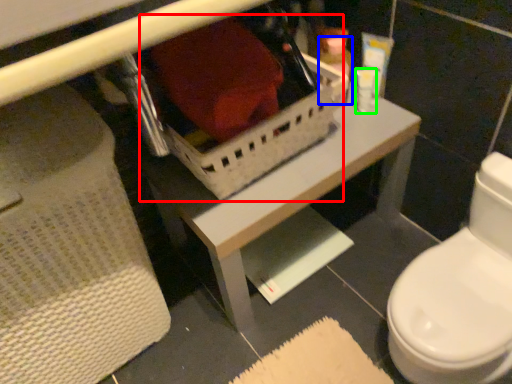
Question: Which object is positioned closest to storage box (highlighted by a red box)? Select from toiletry (highlighted by a blue box) and toiletry (highlighted by a green box).

Choices:
 (A) toiletry
 (B) toiletry

Answer: (A)